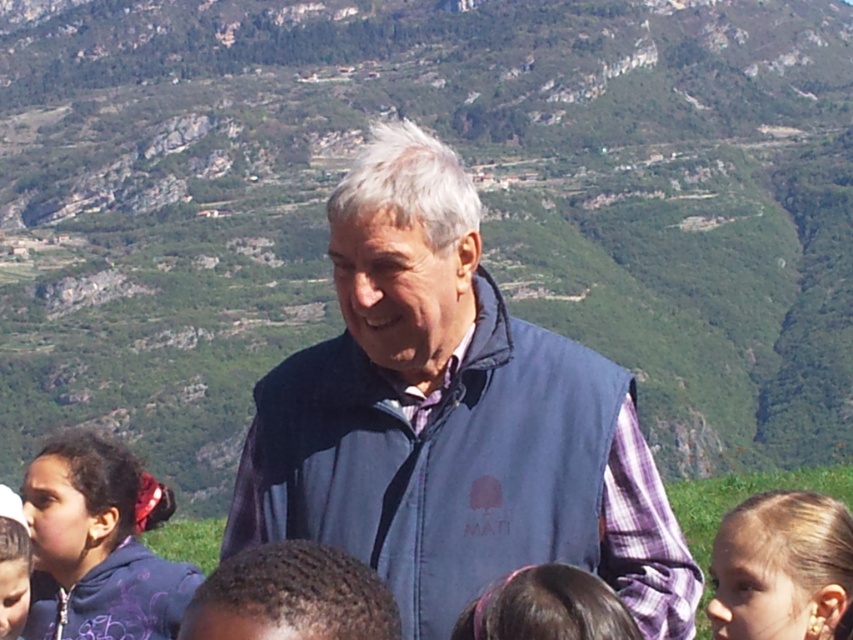
Question: Is dark blue hoodie at lower left below dark brown hair at center?

Choices:
 (A) yes
 (B) no

Answer: (A)

Question: Considering the relative positions of blue fabric vest at center and brown hair at center in the image provided, where is blue fabric vest at center located with respect to brown hair at center?

Choices:
 (A) above
 (B) below

Answer: (A)

Question: Which point is farther from the camera taking this photo?

Choices:
 (A) (21, 484)
 (B) (0, 572)
 (C) (340, 604)

Answer: (A)

Question: Estimate the real-world distances between objects in this image. Which object is closer to the blue fabric vest at center?

Choices:
 (A) dark brown hair at center
 (B) brown hair at center
 (C) matte purple hoodie at lower left
 (D) blonde hair at lower right

Answer: (B)

Question: Which of the following is the farthest from the observer?

Choices:
 (A) (125, 500)
 (B) (756, 496)

Answer: (B)

Question: Is dark blue hoodie at lower left above brown hair at center?

Choices:
 (A) no
 (B) yes

Answer: (A)